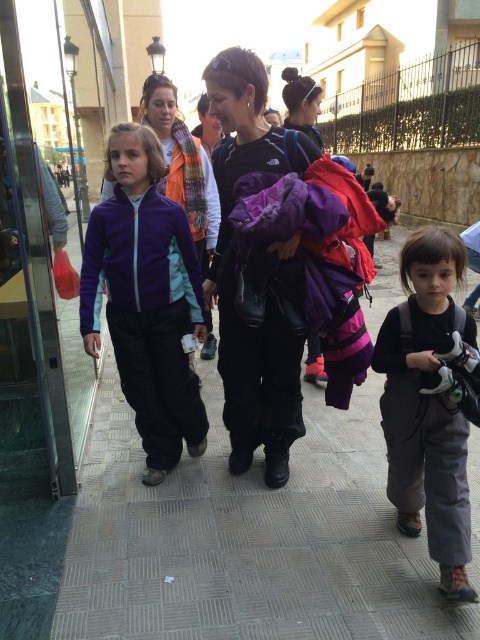
Is point (120, 300) farther from viewer compared to point (286, 324)?

Yes, it is behind point (286, 324).

Can you confirm if purple fleece jacket at left is smaller than matte black jacket at center?

Yes, purple fleece jacket at left is smaller than matte black jacket at center.

This screenshot has width=480, height=640. In order to click on purple fleece jacket at left in this screenshot , I will do `click(145, 298)`.

This screenshot has height=640, width=480. What are the coordinates of `purple fleece jacket at left` in the screenshot? It's located at (145, 298).

Can you confirm if gray fabric backpack at lower right is thinner than matte black jacket at center?

Yes.

Which of these two, gray fabric backpack at lower right or matte black jacket at center, stands taller?

matte black jacket at center

Is point (435, 300) farther from viewer compared to point (230, 358)?

No.

Where is `gray fabric backpack at lower right`? gray fabric backpack at lower right is located at coordinates (428, 404).

Does gray tile pavement at center have a smaller size compared to purple fleece jacket at center?

Incorrect, gray tile pavement at center is not smaller in size than purple fleece jacket at center.

I want to click on gray tile pavement at center, so click(x=247, y=538).

Which is in front, point (175, 584) or point (159, 81)?

Positioned in front is point (175, 584).

Identify the location of gray tile pavement at center. (247, 538).